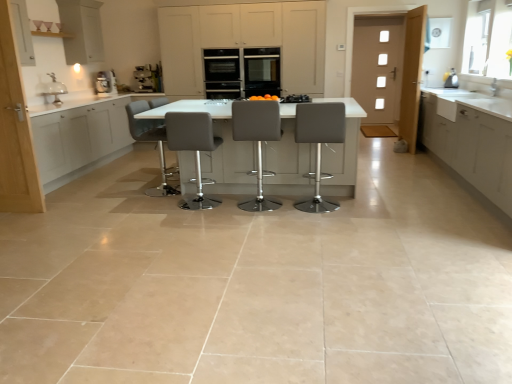
Question: From the image's perspective, relative to satin silver coffee machine at center, acting as the second coffee machine starting from the left, is metallic gray coffee machine at upper left, marked as the 1th coffee machine in a left-to-right arrangement, above or below?

Choices:
 (A) above
 (B) below

Answer: (B)

Question: In the image, is metallic gray coffee machine at upper left, the 2th coffee machine when ordered from right to left, on the left side or the right side of satin silver coffee machine at center, acting as the second coffee machine starting from the left?

Choices:
 (A) right
 (B) left

Answer: (B)

Question: Which is farther from the matte gray bar stool at center, arranged as the 3th chair when viewed from the left?

Choices:
 (A) grey leather stool at center, the fourth chair positioned from the left
 (B) white matte cabinet at left, which is counted as the second cabinetry, starting from the left
 (C) metallic silver kettle at upper right, which appears as the second appliance when viewed from the top
 (D) satin grey bar stool at center, acting as the third chair starting from the right
 (E) white glossy table at center

Answer: (C)

Question: Based on their relative distances, which object is nearer to the white matte cabinet at left, acting as the fourth cabinetry starting from the right?

Choices:
 (A) satin grey bar stool at center, acting as the third chair starting from the right
 (B) matte gray bar stool at center, the second chair when ordered from right to left
 (C) white glossy cabinet at right, placed as the fifth cabinetry when sorted from left to right
 (D) metallic gray coffee machine at upper left, the 2th coffee machine when ordered from right to left
 (E) matte white cabinet at upper left, the fifth cabinetry viewed from the right

Answer: (E)